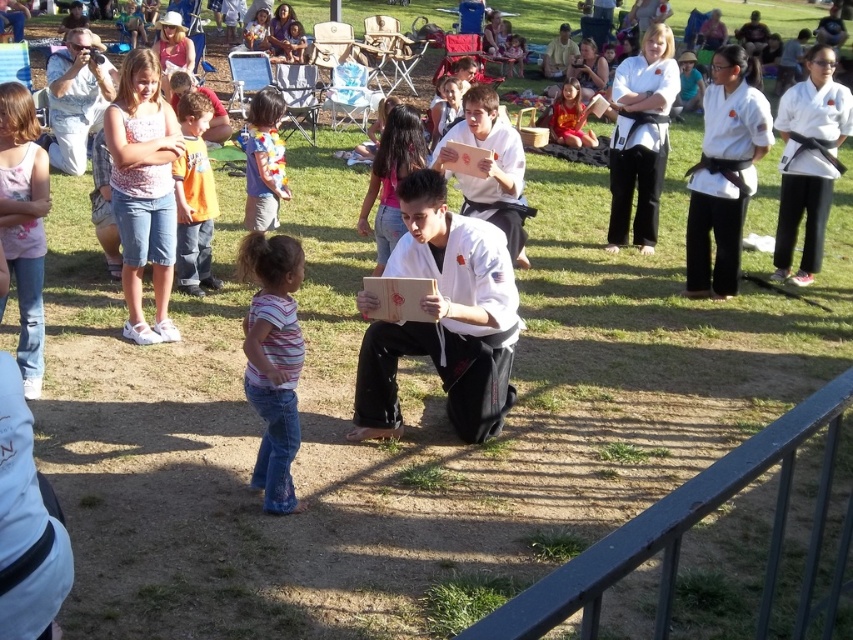
Does white karate uniform at right appear under striped cotton shirt at center?

Actually, white karate uniform at right is above striped cotton shirt at center.

This screenshot has height=640, width=853. Find the location of `white karate uniform at right`. white karate uniform at right is located at coordinates (724, 173).

Which is in front, point (374, 358) or point (268, 157)?

Point (374, 358)

Does white matte board at center have a greater width compared to multicolored fabric shirt at center?

Correct, the width of white matte board at center exceeds that of multicolored fabric shirt at center.

Where is `white matte board at center`? white matte board at center is located at coordinates (444, 317).

Image resolution: width=853 pixels, height=640 pixels. What do you see at coordinates (392, 177) in the screenshot?
I see `striped shirt at center` at bounding box center [392, 177].

Can you confirm if striped shirt at center is wider than matte orange shirt at upper center?

Incorrect, striped shirt at center's width does not surpass matte orange shirt at upper center's.

Locate an element on the screen. striped shirt at center is located at coordinates (392, 177).